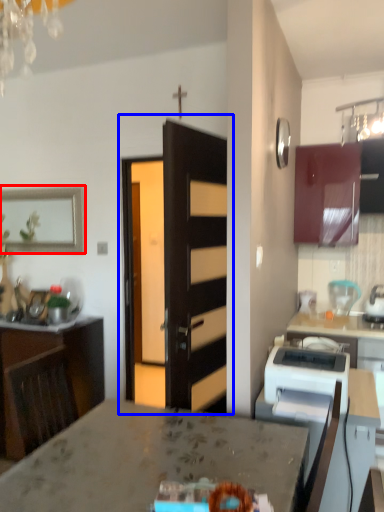
Question: Which object appears closest to the camera in this image, picture frame (highlighted by a red box) or door (highlighted by a blue box)?

Choices:
 (A) picture frame
 (B) door

Answer: (B)